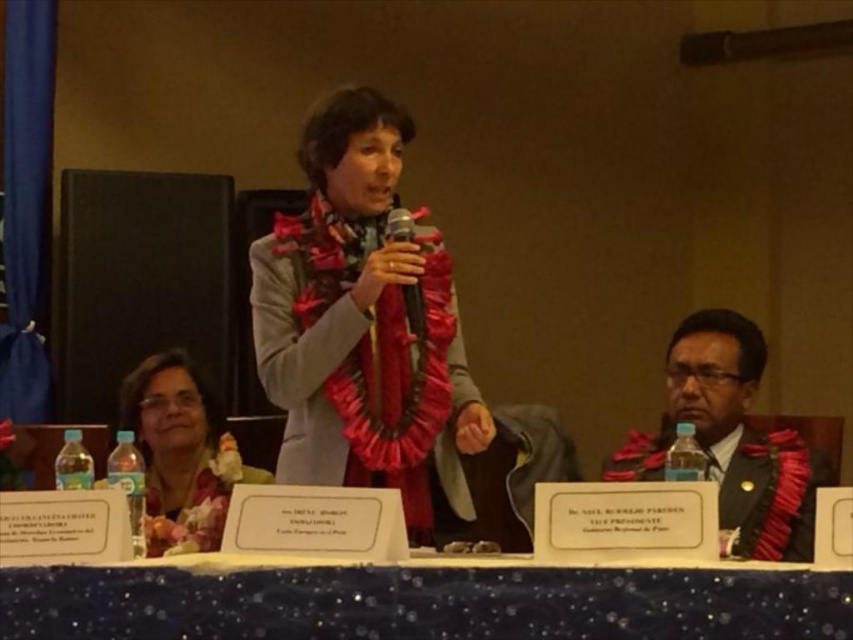
Question: From the image, what is the correct spatial relationship of blue glitter tablecloth at center in relation to metallic silver microphone at center?

Choices:
 (A) below
 (B) above

Answer: (A)

Question: Is matte black scarf at lower right above matte pink scarf at lower left?

Choices:
 (A) no
 (B) yes

Answer: (B)

Question: Which object appears farthest from the camera in this image?

Choices:
 (A) blue glitter tablecloth at center
 (B) matte black scarf at lower right
 (C) matte gray scarf at center

Answer: (C)

Question: Can you confirm if blue glitter tablecloth at center is smaller than matte pink scarf at lower left?

Choices:
 (A) yes
 (B) no

Answer: (A)

Question: Among these points, which one is nearest to the camera?

Choices:
 (A) [x=218, y=548]
 (B) [x=212, y=616]
 (C) [x=392, y=214]
 (D) [x=331, y=365]

Answer: (B)

Question: Which point is farther to the camera?

Choices:
 (A) metallic silver microphone at center
 (B) matte gray scarf at center

Answer: (A)